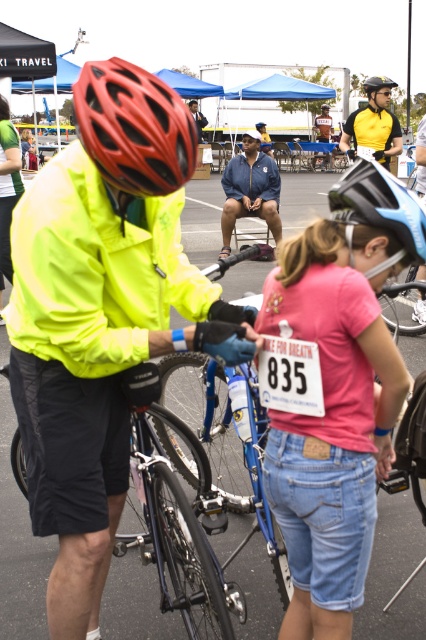
Question: Based on their relative distances, which object is farther from the yellow matte safety vest at upper center?

Choices:
 (A) shiny black bicycle at center
 (B) pink fabric shirt at center
 (C) matte black helmet at center

Answer: (C)

Question: Estimate the real-world distances between objects in this image. Which object is farther from the yellow reflective jacket at center?

Choices:
 (A) pink fabric shirt at center
 (B) shiny black bicycle at center

Answer: (A)

Question: Based on their relative distances, which object is nearer to the shiny black helmet at upper center?

Choices:
 (A) blue matte bicycle helmet at center
 (B) yellow reflective jacket at center

Answer: (B)

Question: Does shiny black bicycle at center have a lesser width compared to yellow matte safety vest at upper center?

Choices:
 (A) yes
 (B) no

Answer: (B)

Question: Where is yellow jersey at upper center located in relation to yellow reflective jacket at center in the image?

Choices:
 (A) right
 (B) left

Answer: (B)

Question: Can you confirm if blue matte bicycle helmet at center is wider than yellow reflective jacket at center?

Choices:
 (A) yes
 (B) no

Answer: (B)